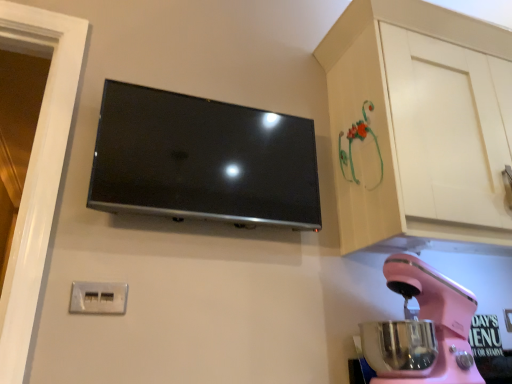
Question: From the image's perspective, is pink plastic stand mixer at lower right below matte black tv at upper center?

Choices:
 (A) no
 (B) yes

Answer: (B)

Question: Considering the relative sizes of pink plastic stand mixer at lower right and matte black tv at upper center in the image provided, is pink plastic stand mixer at lower right smaller than matte black tv at upper center?

Choices:
 (A) no
 (B) yes

Answer: (A)

Question: Is pink plastic stand mixer at lower right behind matte black tv at upper center?

Choices:
 (A) yes
 (B) no

Answer: (B)

Question: Could you tell me if pink plastic stand mixer at lower right is facing matte black tv at upper center?

Choices:
 (A) yes
 (B) no

Answer: (B)

Question: Can you confirm if pink plastic stand mixer at lower right is taller than matte black tv at upper center?

Choices:
 (A) no
 (B) yes

Answer: (A)

Question: From a real-world perspective, is pink plastic stand mixer at lower right on top of matte black tv at upper center?

Choices:
 (A) no
 (B) yes

Answer: (A)

Question: From a real-world perspective, is white plastic electrical outlet at lower left physically above pink plastic stand mixer at lower right?

Choices:
 (A) yes
 (B) no

Answer: (A)

Question: Can you confirm if white plastic electrical outlet at lower left is thinner than pink plastic stand mixer at lower right?

Choices:
 (A) yes
 (B) no

Answer: (A)

Question: Can you confirm if white plastic electrical outlet at lower left is positioned to the right of pink plastic stand mixer at lower right?

Choices:
 (A) yes
 (B) no

Answer: (B)

Question: Can you confirm if white plastic electrical outlet at lower left is smaller than pink plastic stand mixer at lower right?

Choices:
 (A) yes
 (B) no

Answer: (A)

Question: Is white plastic electrical outlet at lower left facing towards pink plastic stand mixer at lower right?

Choices:
 (A) yes
 (B) no

Answer: (B)

Question: Is white plastic electrical outlet at lower left located outside pink plastic stand mixer at lower right?

Choices:
 (A) yes
 (B) no

Answer: (A)

Question: Considering the relative sizes of pink plastic stand mixer at lower right and white plastic electrical outlet at lower left in the image provided, is pink plastic stand mixer at lower right bigger than white plastic electrical outlet at lower left?

Choices:
 (A) no
 (B) yes

Answer: (B)